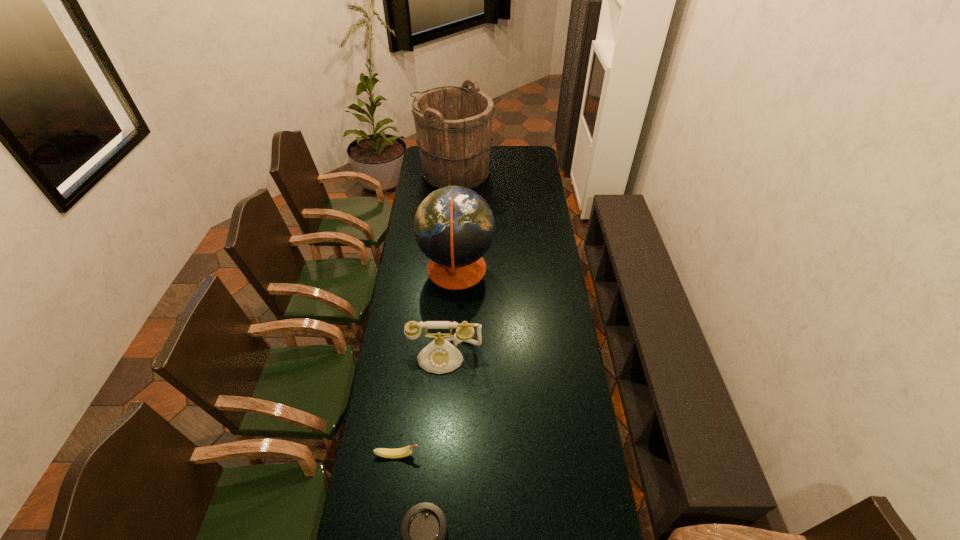
Identify the location of unoccupied position between the telephone and the second nearest object. This screenshot has width=960, height=540. (421, 406).

Select which object appears as the fourth closest to the banana. Please provide its 2D coordinates. Your answer should be formatted as a tuple, i.e. [(x, y)], where the tuple contains the x and y coordinates of a point satisfying the conditions above.

[(453, 124)]

Locate an element on the screen. object that ranks as the closest to the telephoto lens is located at coordinates (405, 451).

I want to click on vacant point that satisfies the following two spatial constraints: 1. on the dial of the third tallest object; 2. at the stem of the banana, so click(439, 455).